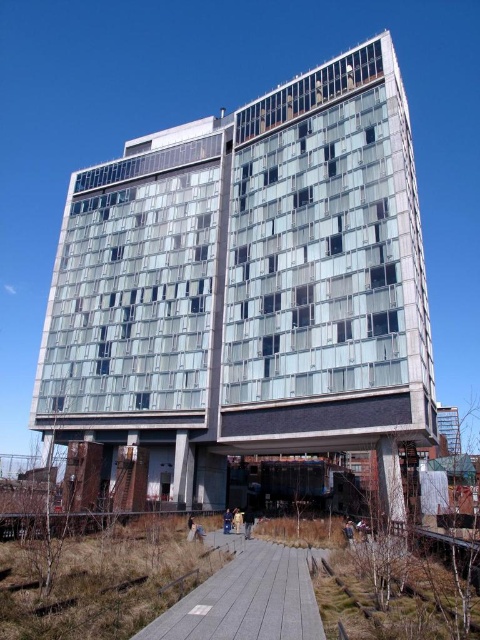
You are standing on the gray concrete path at center and want to enter the glassy concrete building at center. Which direction should you look to see the entrance?

The glassy concrete building at center is located above the gray concrete path at center, so you should look upward to see the entrance.

You are standing at the center of the image. Which direction should you move to get closer to the glassy concrete building at center?

Since the glassy concrete building at center is already at the center of the image, you don not need to move in any direction to get closer to it. You are already at the optimal position.